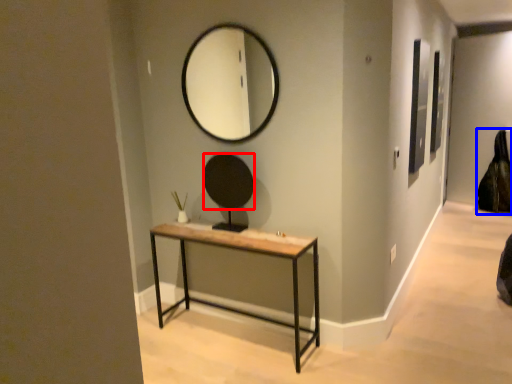
Question: Which object is closer to the camera taking this photo, mirror (highlighted by a red box) or swivel chair (highlighted by a blue box)?

Choices:
 (A) mirror
 (B) swivel chair

Answer: (A)